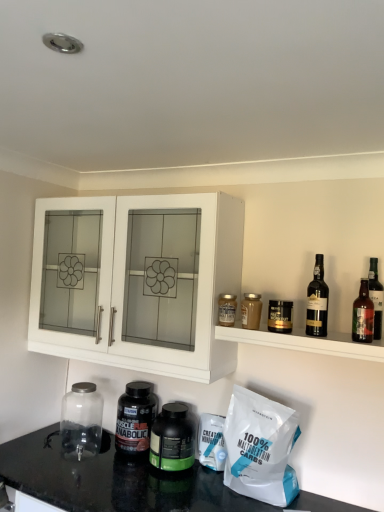
Question: Is white matte cabinet at upper left in front of translucent glass jar at shelf right, the fourth bottle positioned from the left?

Choices:
 (A) no
 (B) yes

Answer: (A)

Question: Is white matte cabinet at upper left wider than translucent glass jar at shelf right, positioned as the first bottle in top-to-bottom order?

Choices:
 (A) yes
 (B) no

Answer: (A)

Question: Would you say translucent glass jar at shelf right, which is the 5th bottle in bottom-to-top order, is part of white matte cabinet at upper left's contents?

Choices:
 (A) no
 (B) yes

Answer: (A)

Question: From the image's perspective, is white matte cabinet at upper left located beneath translucent glass jar at shelf right, positioned as the first bottle in top-to-bottom order?

Choices:
 (A) no
 (B) yes

Answer: (A)

Question: Is white matte cabinet at upper left thinner than translucent glass jar at shelf right, the fourth bottle positioned from the left?

Choices:
 (A) yes
 (B) no

Answer: (B)

Question: From a real-world perspective, is white matte cabinet at upper left over translucent glass jar at shelf right, which is the 5th bottle in bottom-to-top order?

Choices:
 (A) yes
 (B) no

Answer: (A)

Question: Can you confirm if white matte bag of 100% maltodextrin carbs at lower right is smaller than transparent glass jar at lower left?

Choices:
 (A) yes
 (B) no

Answer: (B)

Question: From the image's perspective, is white matte bag of 100% maltodextrin carbs at lower right over transparent glass jar at lower left?

Choices:
 (A) yes
 (B) no

Answer: (A)

Question: Are white matte bag of 100% maltodextrin carbs at lower right and transparent glass jar at lower left making contact?

Choices:
 (A) no
 (B) yes

Answer: (A)

Question: Is white matte bag of 100% maltodextrin carbs at lower right shorter than transparent glass jar at lower left?

Choices:
 (A) yes
 (B) no

Answer: (B)

Question: From a real-world perspective, is white matte bag of 100% maltodextrin carbs at lower right physically below transparent glass jar at lower left?

Choices:
 (A) no
 (B) yes

Answer: (A)

Question: From a real-world perspective, is white matte bag of 100% maltodextrin carbs at lower right over transparent glass jar at lower left?

Choices:
 (A) yes
 (B) no

Answer: (A)

Question: Can you confirm if green matte bottle at center, positioned as the first bottle in bottom-to-top order, is taller than white matte cabinet at upper left?

Choices:
 (A) yes
 (B) no

Answer: (B)